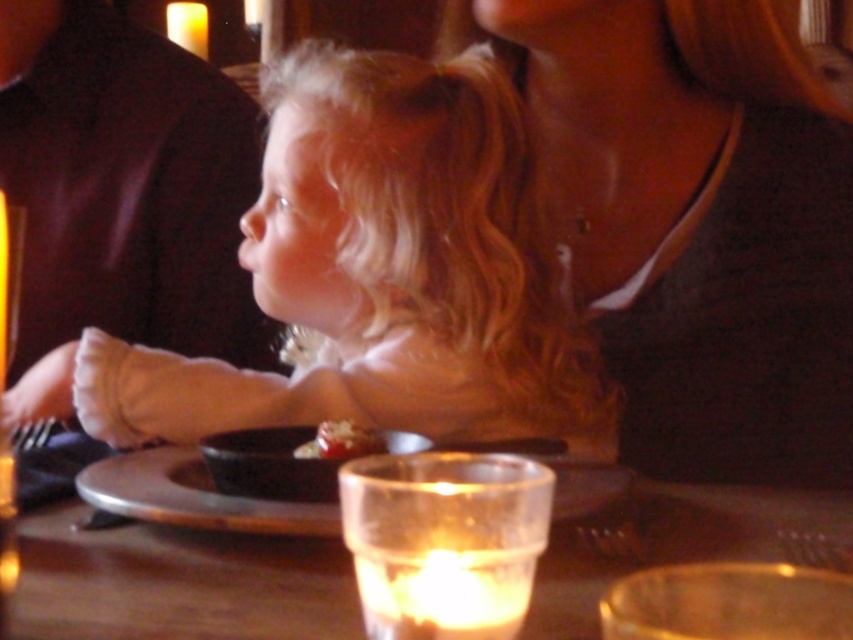
From the picture: Where is the matte black shirt at upper left located in the image?

The matte black shirt at upper left is located at point (122,193) in the image.

You are a photographer adjusting your camera settings to focus on the smooth chocolate cake at center. However, you notice the matte black shirt at upper left is also in the frame. Which object should you adjust your focus to prioritize if you want the cake to be sharp and clear?

The matte black shirt at upper left is further to the viewer than the smooth chocolate cake at center, so to focus on the cake at center, you need to adjust the focus to the smooth chocolate cake at center.